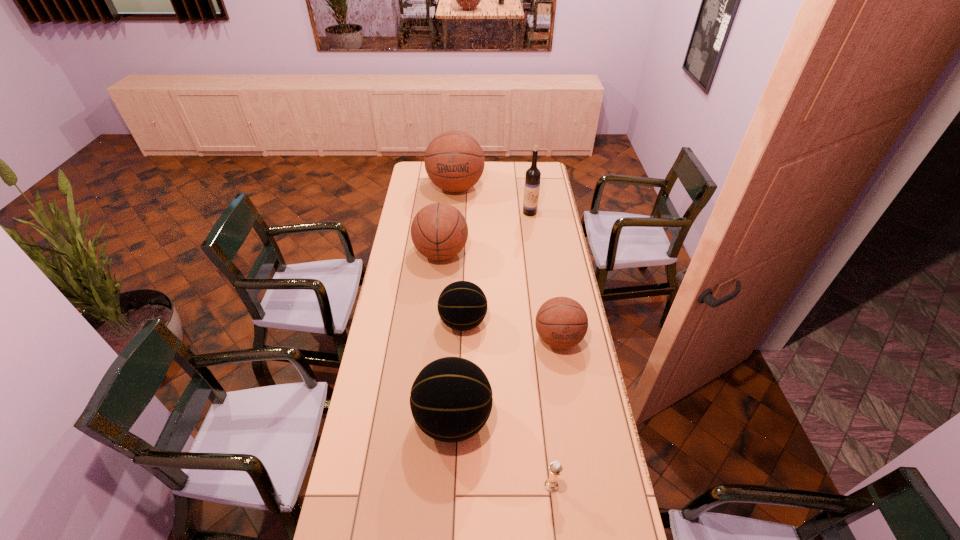
This screenshot has height=540, width=960. I want to click on the farther black basketball, so click(x=462, y=305).

Locate an element on the screen. The width and height of the screenshot is (960, 540). the shortest object is located at coordinates (555, 468).

Where is `candle holder`? candle holder is located at coordinates (555, 468).

I want to click on vacant space located on the label of the sixth nearest object, so click(532, 226).

The image size is (960, 540). I want to click on free space located on the side with brand label of the second tallest object, so click(453, 227).

Where is `vacant area situated on the side with brand label of the second smallest brown basketball`? vacant area situated on the side with brand label of the second smallest brown basketball is located at coordinates (500, 253).

Find the location of `free space located on the left of the nearest basketball`. free space located on the left of the nearest basketball is located at coordinates (394, 420).

Identify the location of vacant space located on the side with brand label of the smallest brown basketball. This screenshot has height=540, width=960. (579, 464).

The image size is (960, 540). Find the location of `blank space located on the left of the farther black basketball`. blank space located on the left of the farther black basketball is located at coordinates (410, 322).

You are a GUI agent. You are given a task and a screenshot of the screen. Output one action in this format:
    pyautogui.click(x=<x>, y=<y>)
    Task: Click on the free location located 0.350m on the back of the shortest object
    This screenshot has width=960, height=540.
    Given the screenshot: What is the action you would take?
    (x=540, y=381)